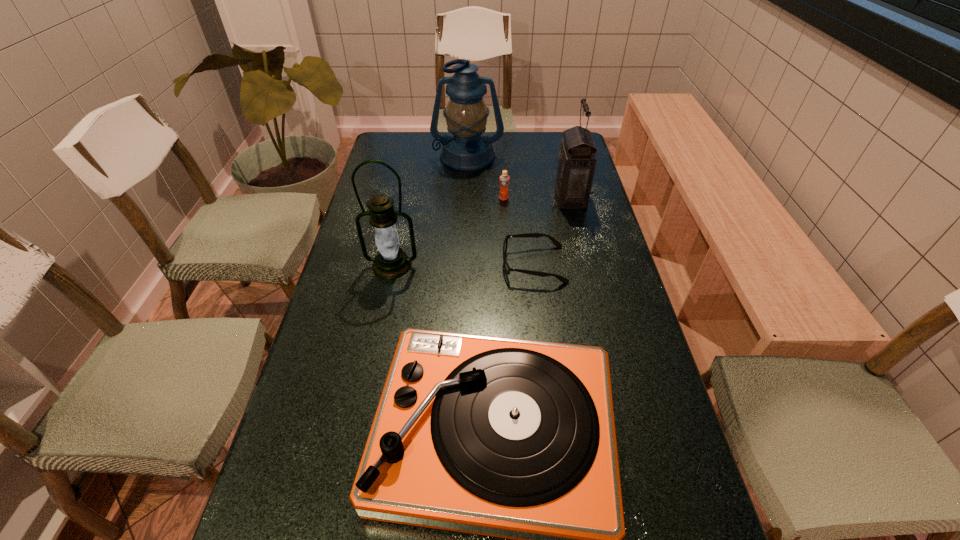
This screenshot has width=960, height=540. I want to click on vacant space located on the left of the orange juice, so coord(424,198).

You are a GUI agent. You are given a task and a screenshot of the screen. Output one action in this format:
    pyautogui.click(x=<x>, y=<y>)
    Task: Click on the blank space located on the front-facing side of the shortest object
    
    Given the screenshot: What is the action you would take?
    pyautogui.click(x=446, y=264)

This screenshot has width=960, height=540. Identify the location of free point located on the front-facing side of the shortest object. (383, 264).

Find the location of a particular element. This screenshot has width=960, height=540. free space located 0.110m on the front-facing side of the shortest object is located at coordinates (464, 264).

Where is `object that is at the far edge`? object that is at the far edge is located at coordinates (467, 149).

At what (x,y) coordinates should I click in order to perform the action: click on object present at the left edge. Please return your answer as a coordinate pair (x, y). Looking at the image, I should click on (391, 262).

Find the location of a particular element. The width and height of the screenshot is (960, 540). lantern located in the right edge section of the desktop is located at coordinates [x=576, y=162].

Where is `spectacles that is positioned at the right edge`? spectacles that is positioned at the right edge is located at coordinates (535, 235).

At what (x,y) coordinates should I click in order to perform the action: click on free space at the left edge. Please return your answer as a coordinate pair (x, y). The image size is (960, 540). Looking at the image, I should click on (405, 168).

At what (x,y) coordinates should I click in order to perform the action: click on vacant space at the right edge of the desktop. Please return your answer as a coordinate pair (x, y). This screenshot has width=960, height=540. Looking at the image, I should click on (600, 253).